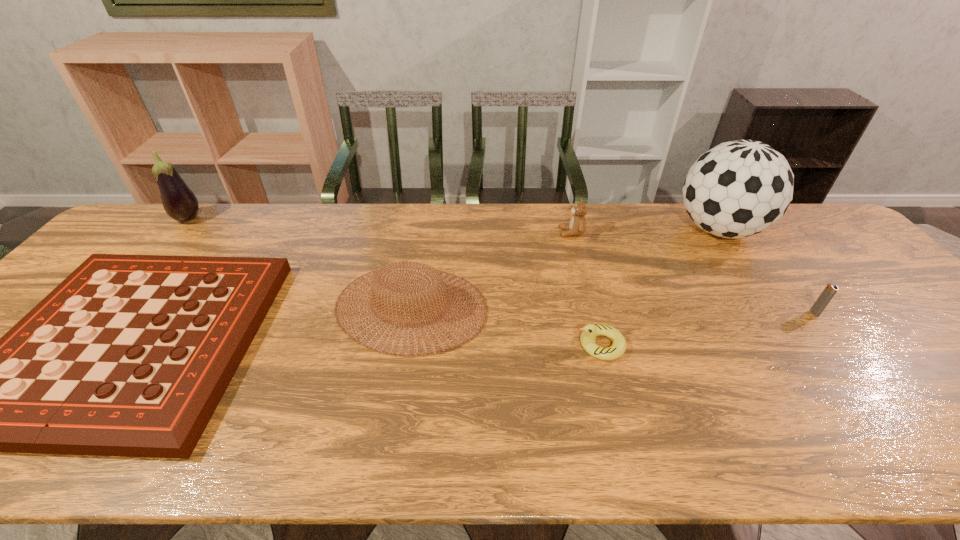
You are a GUI agent. You are given a task and a screenshot of the screen. Output one action in this format:
    pyautogui.click(x=<x>, y=<y>)
    Task: Click on the free spot located on the front-facing side of the teddy bear
    This screenshot has height=540, width=960.
    Given the screenshot: What is the action you would take?
    pyautogui.click(x=444, y=233)

Find the location of a particular element. Image resolution: width=960 pixels, height=540 pixels. free spot located 0.220m on the back of the sunhat is located at coordinates (424, 224).

Where is `vacant space located 0.190m on the front of the igniter`? The height and width of the screenshot is (540, 960). vacant space located 0.190m on the front of the igniter is located at coordinates (866, 380).

At what (x,y) coordinates should I click in order to perform the action: click on vacant space located 0.170m on the face of the duckling. Please return your answer as a coordinate pair (x, y). The width and height of the screenshot is (960, 540). Looking at the image, I should click on (505, 345).

Where is `vacant area situated 0.240m on the face of the duckling`? vacant area situated 0.240m on the face of the duckling is located at coordinates [x=475, y=345].

Locate an element on the screen. Image resolution: width=960 pixels, height=540 pixels. vacant space located on the face of the duckling is located at coordinates (492, 345).

Locate an element on the screen. soccer ball present at the far edge is located at coordinates (740, 188).

Locate an element on the screen. Image resolution: width=960 pixels, height=540 pixels. eggplant that is at the far edge is located at coordinates (180, 203).

The height and width of the screenshot is (540, 960). Find the location of `teddy bear situated at the far edge`. teddy bear situated at the far edge is located at coordinates (577, 226).

This screenshot has width=960, height=540. Identify the location of object located at the left edge. (180, 203).